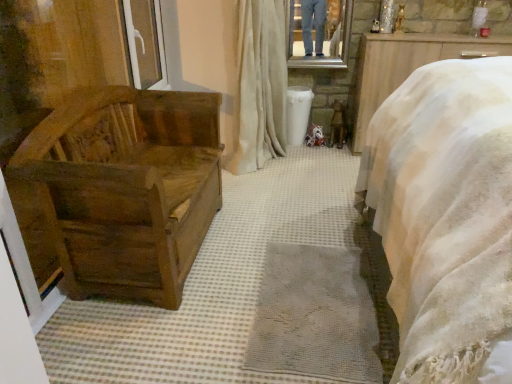
Question: Considering the positions of metallic reflective mirror at upper center and white plastic window at upper left in the image, is metallic reflective mirror at upper center taller or shorter than white plastic window at upper left?

Choices:
 (A) tall
 (B) short

Answer: (B)

Question: Which is correct: metallic reflective mirror at upper center is inside white plastic window at upper left, or outside of it?

Choices:
 (A) outside
 (B) inside

Answer: (A)

Question: Considering the real-world distances, which object is farthest from the wooden chest at left?

Choices:
 (A) white plastic window at upper left
 (B) metallic reflective mirror at upper center
 (C) satin beige curtain at center

Answer: (B)

Question: Which of these objects is positioned closest to the wooden chest at left?

Choices:
 (A) metallic reflective mirror at upper center
 (B) satin beige curtain at center
 (C) white plastic window at upper left

Answer: (B)